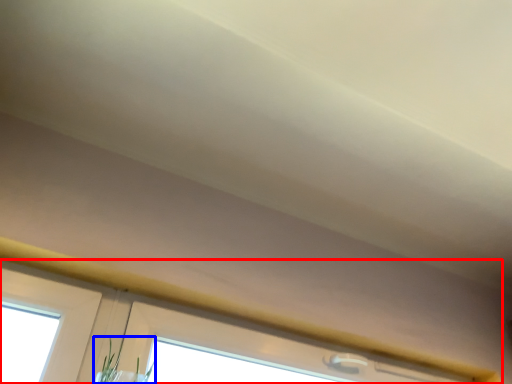
Question: Which of the following is the closest to the observer, window (highlighted by a red box) or plant (highlighted by a blue box)?

Choices:
 (A) window
 (B) plant

Answer: (B)